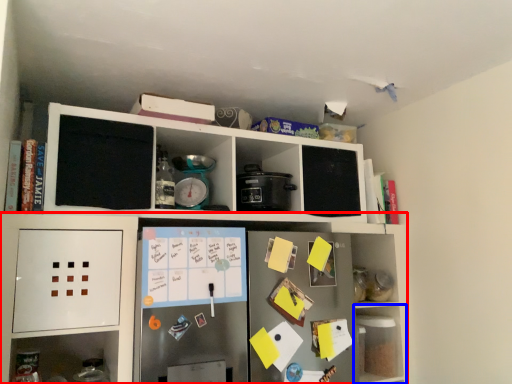
Question: Which object is further to the camera taking this photo, shelf (highlighted by a red box) or shelf (highlighted by a blue box)?

Choices:
 (A) shelf
 (B) shelf

Answer: (B)